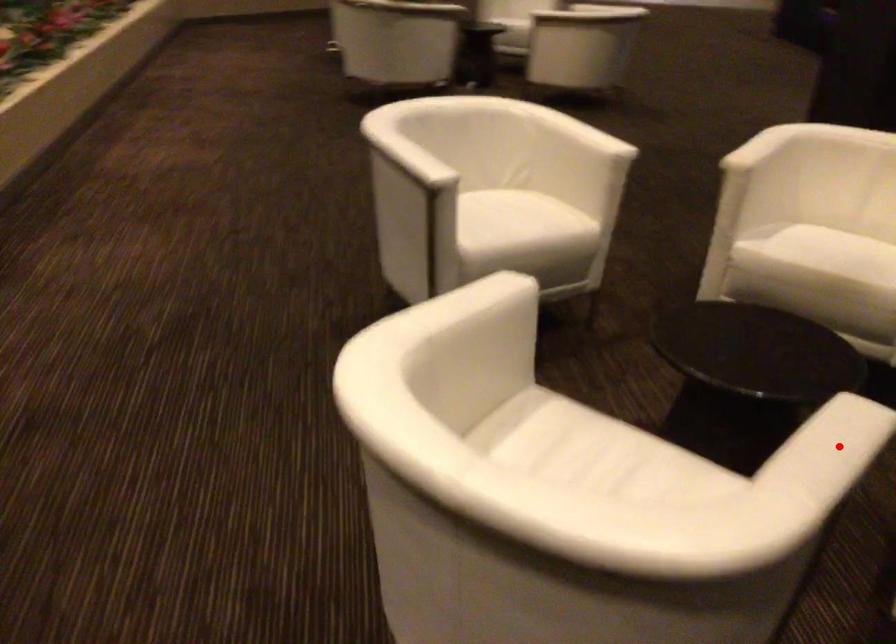
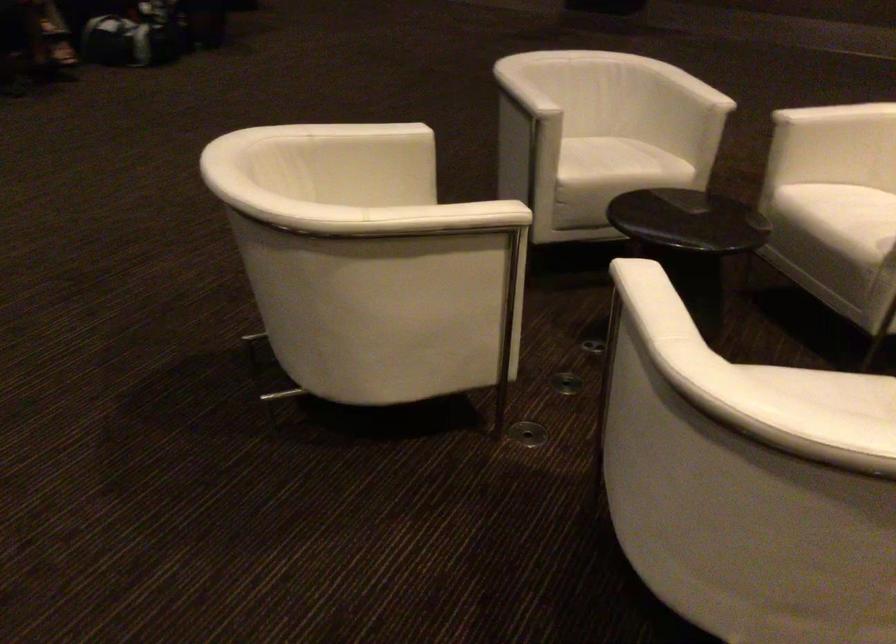
Question: I am providing you with two images of the same scene from different viewpoints. A red point is marked on the first image. Is the red point's position out of view in image 2?

Choices:
 (A) Yes
 (B) No

Answer: (A)